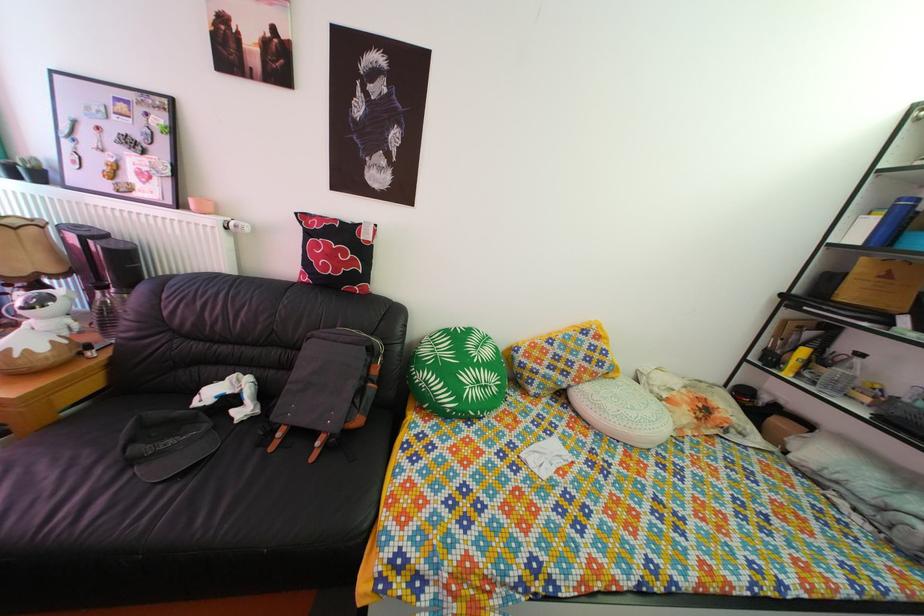
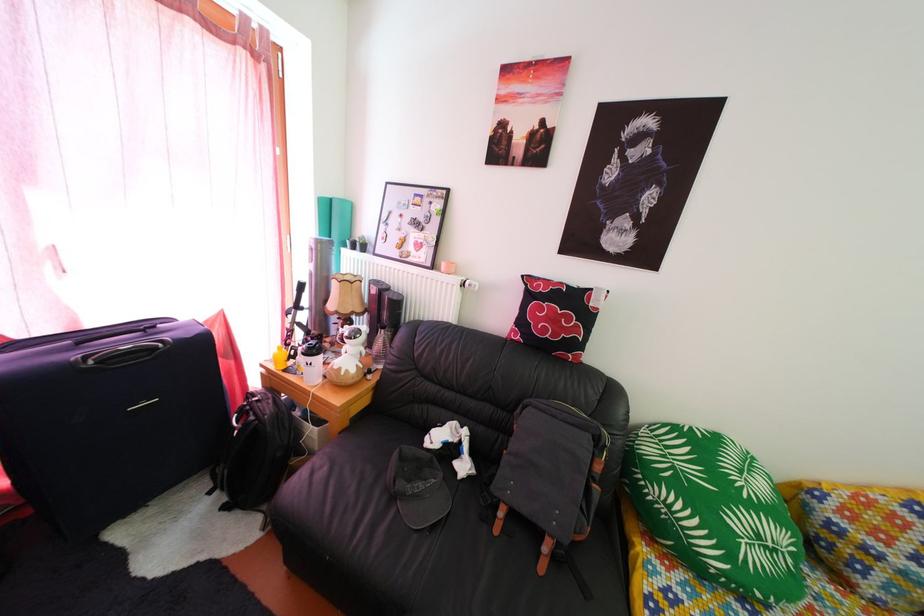
In the second image, find the point that corresponds to point (494, 395) in the first image.

(784, 560)